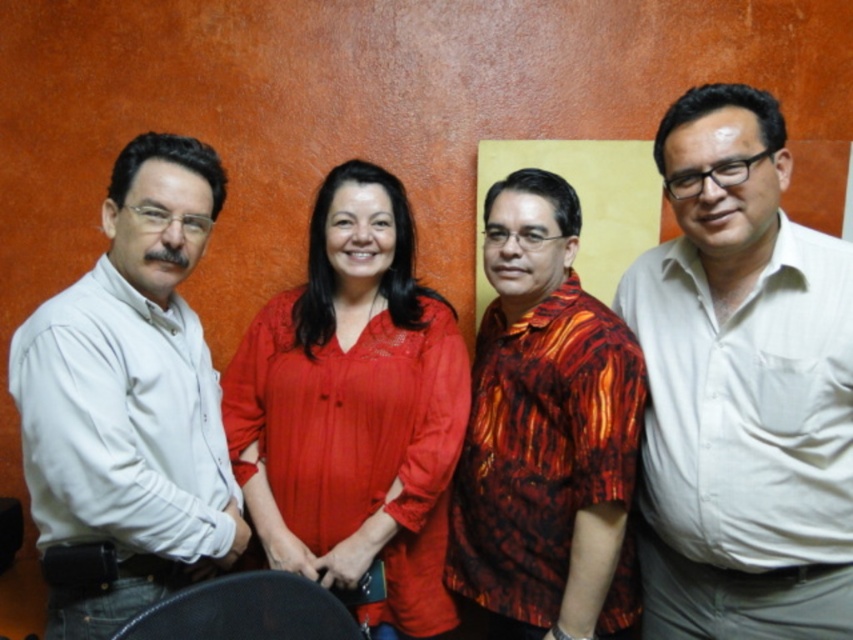
You are standing in front of the group photo and want to determine the relative positions of two points marked in the image. Which point is closer to you, point (263, 472) or point (494, 273)?

Point (263, 472) is closer to you because it is further to the camera than point (494, 273).

In the scene shown: You are a photographer trying to adjust the spacing between the matte red blouse at center and the white matte shirt at left for a group photo. The minimum distance required between subjects for clear focus is 10 inches. Is the current distance sufficient?

The distance between the matte red blouse at center and the white matte shirt at left is 11.37 inches, which exceeds the minimum required 10 inches. Therefore, the current spacing is sufficient for clear focus.